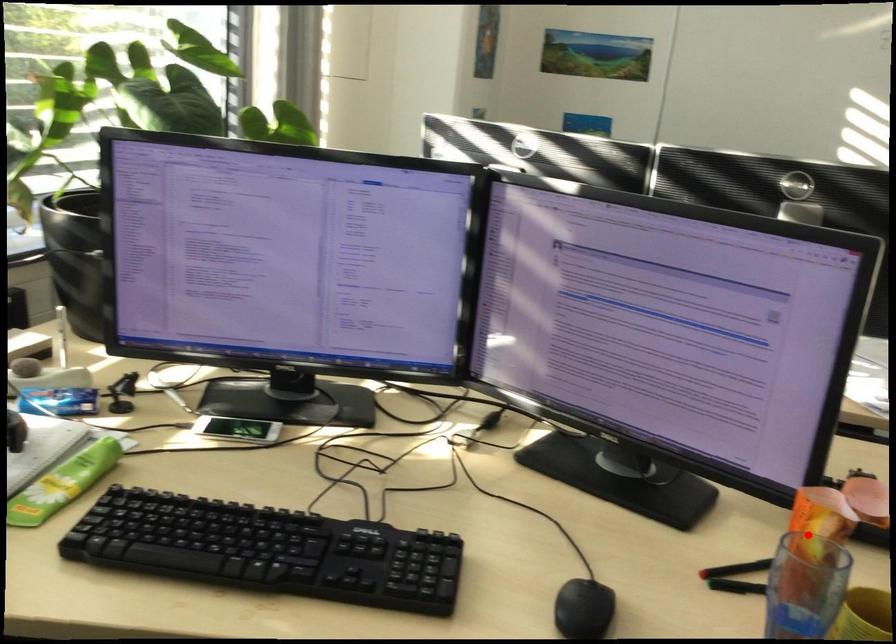
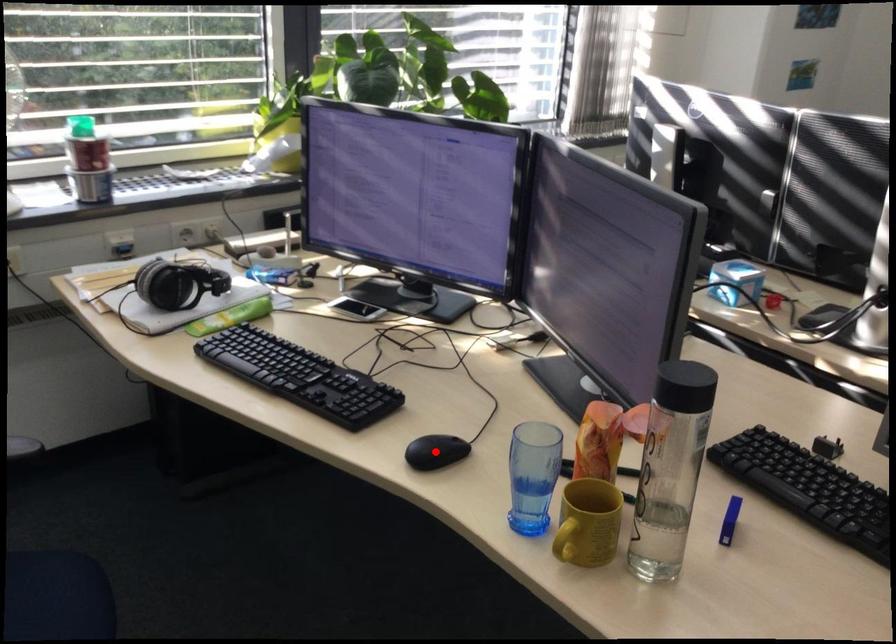
I am providing you with two images of the same scene from different viewpoints. A red point is marked on the first image and another point is marked on the second image. Do the highlighted points in image1 and image2 indicate the same real-world spot?

No